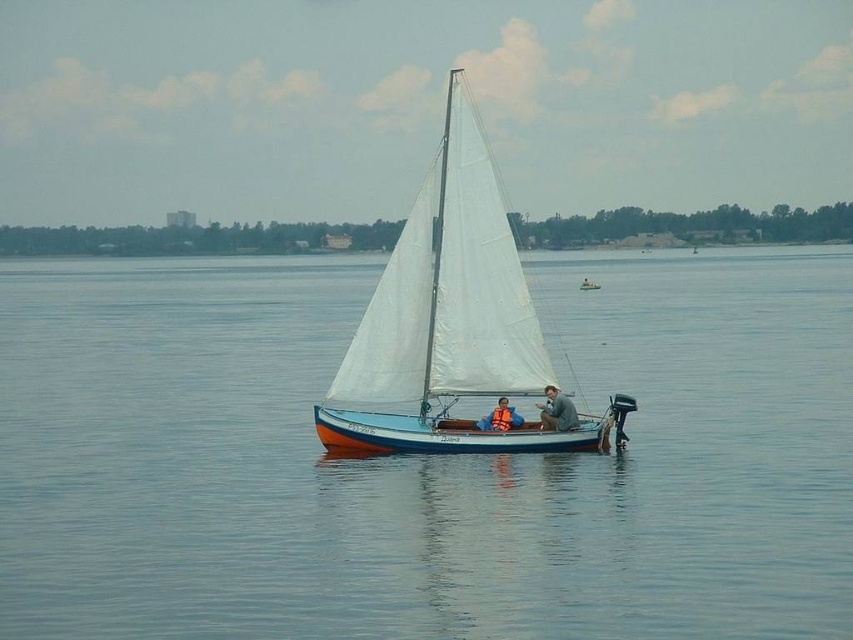
Question: Which object is the farthest from the white sailcloth sailboat at center?

Choices:
 (A) blue fabric jacket at center
 (B) orange life vest at center
 (C) blue smooth water at center

Answer: (C)

Question: Can you confirm if blue fabric jacket at center is wider than white sailboat at center?

Choices:
 (A) yes
 (B) no

Answer: (B)

Question: Estimate the real-world distances between objects in this image. Which object is farther from the white sailcloth sailboat at center?

Choices:
 (A) white sailboat at center
 (B) orange life vest at center
 (C) blue fabric jacket at center
 (D) blue smooth water at center

Answer: (A)

Question: Is blue smooth water at center above orange life vest at center?

Choices:
 (A) no
 (B) yes

Answer: (B)

Question: Among these objects, which one is farthest from the camera?

Choices:
 (A) blue fabric jacket at center
 (B) white sailboat at center
 (C) blue smooth water at center
 (D) white sailcloth sailboat at center

Answer: (B)

Question: Is white sailcloth sailboat at center to the left of white sailboat at center from the viewer's perspective?

Choices:
 (A) no
 (B) yes

Answer: (B)